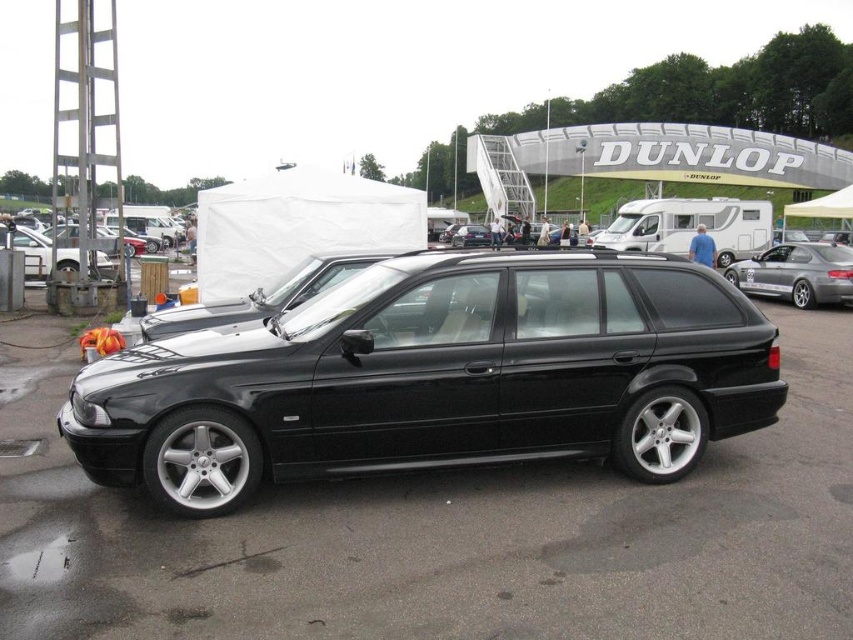
Question: Is black metallic car at center further to camera compared to matte black car at left?

Choices:
 (A) yes
 (B) no

Answer: (B)

Question: Does black metallic car at center have a greater width compared to matte black car at left?

Choices:
 (A) yes
 (B) no

Answer: (B)

Question: Which object appears farthest from the camera in this image?

Choices:
 (A) satin silver metallic sedan at right
 (B) matte black car at left
 (C) matte black wagon at left

Answer: (A)

Question: Can you confirm if satin silver metallic sedan at right is smaller than matte black wagon at left?

Choices:
 (A) yes
 (B) no

Answer: (A)

Question: Which object is the closest to the matte black wagon at left?

Choices:
 (A) satin silver metallic sedan at right
 (B) matte black car at left

Answer: (B)

Question: Which point is closer to the camera taking this photo?

Choices:
 (A) (107, 275)
 (B) (113, 248)

Answer: (A)